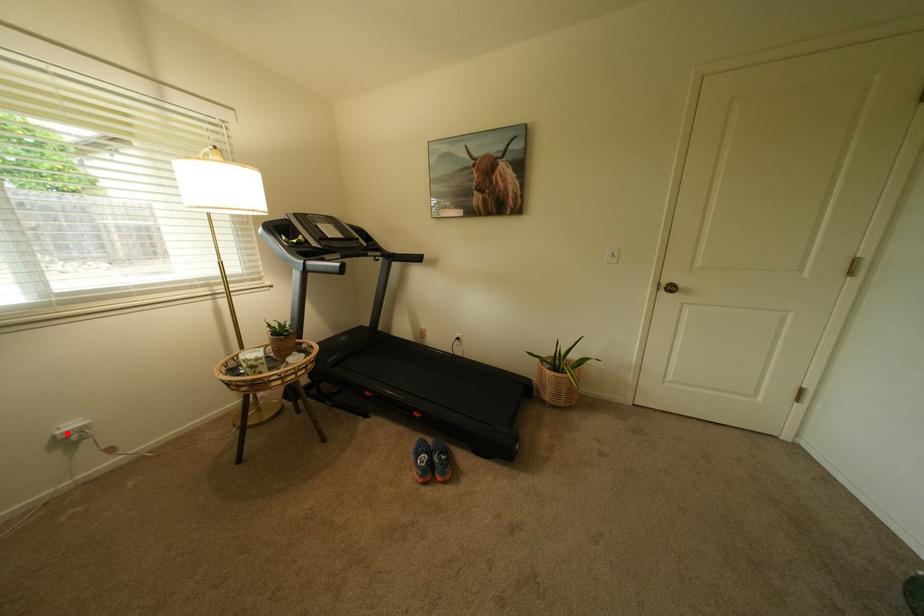
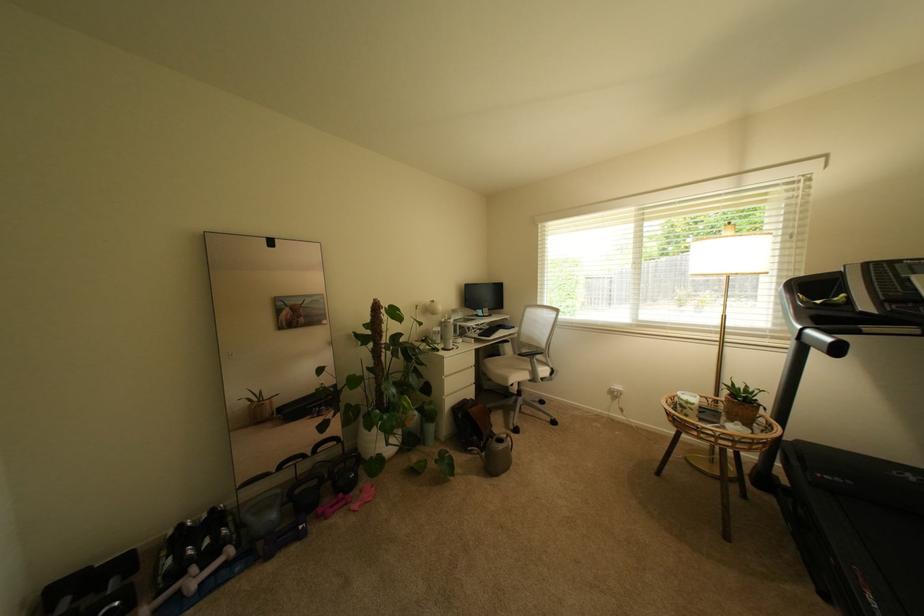
In the second image, find the point that corresponds to the highlighted location in the first image.

(622, 389)